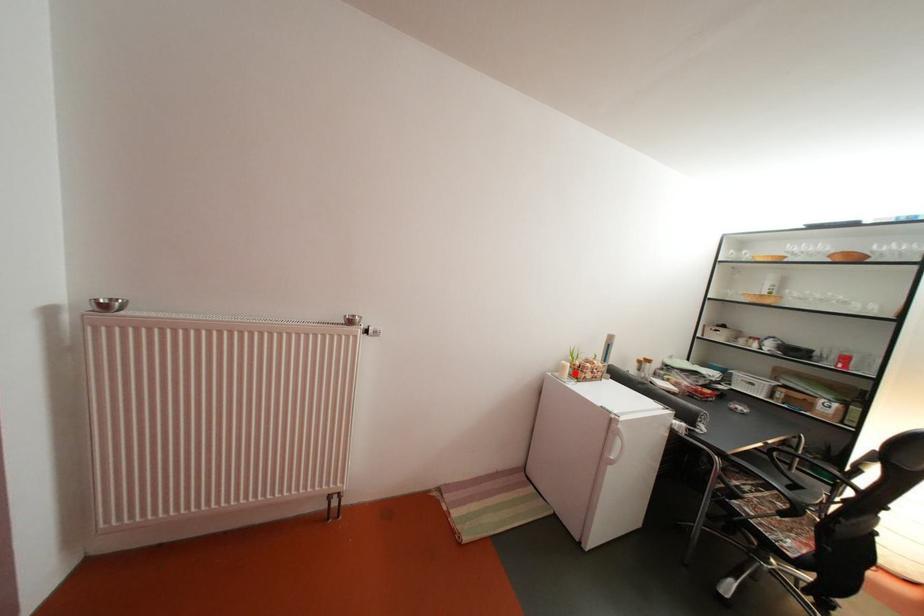
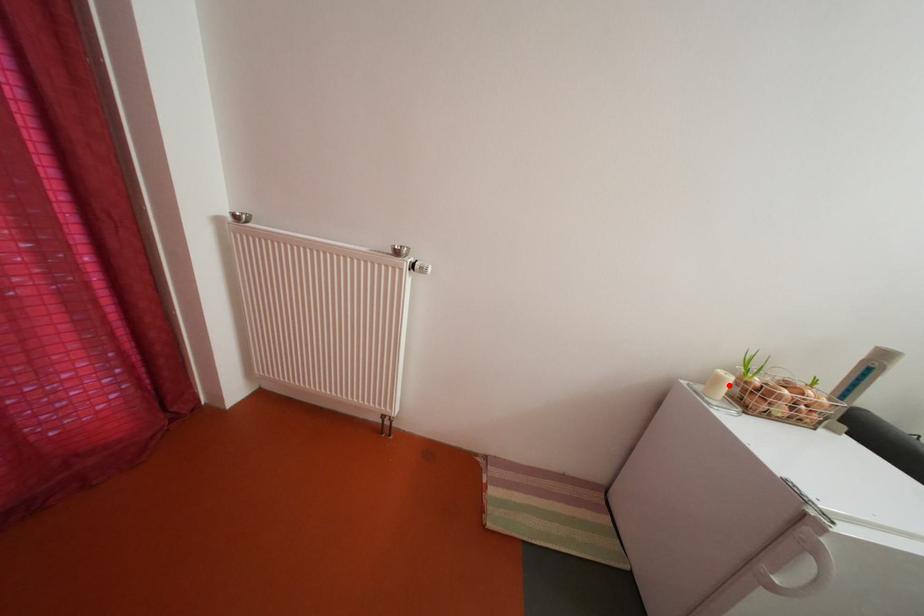
I am providing you with two images of the same scene from different viewpoints. A red point is marked on the first image and another point is marked on the second image. Is the marked point in image1 the same physical position as the marked point in image2?

Yes